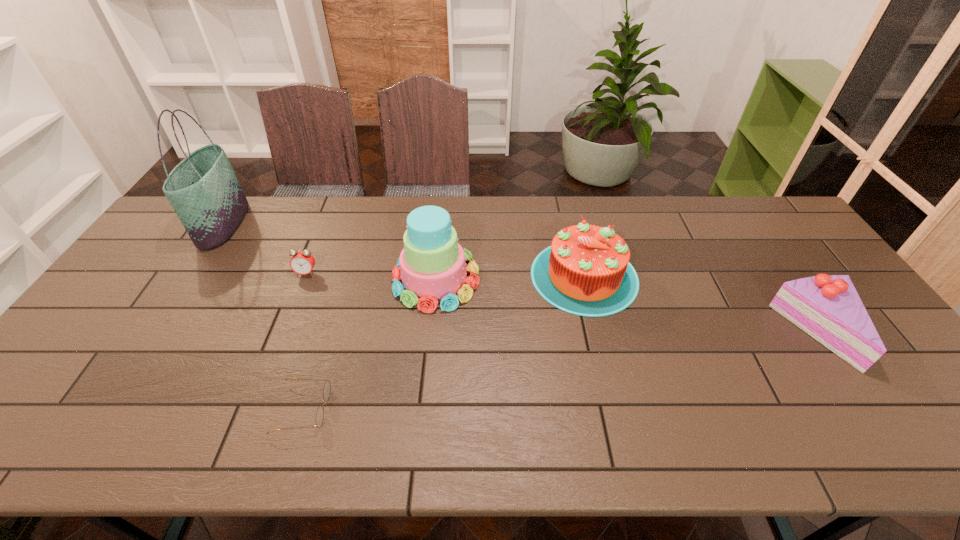
Where is `free space in the image that satisfies the following two spatial constraints: 1. on the front side of the leftmost object; 2. on the left side of the third shortest object`? This screenshot has height=540, width=960. free space in the image that satisfies the following two spatial constraints: 1. on the front side of the leftmost object; 2. on the left side of the third shortest object is located at coordinates (152, 333).

The height and width of the screenshot is (540, 960). I want to click on free spot that satisfies the following two spatial constraints: 1. on the front-facing side of the alarm clock; 2. on the right side of the second cake from right to left, so click(305, 276).

At what (x,y) coordinates should I click in order to perform the action: click on blank area in the image that satisfies the following two spatial constraints: 1. on the front-facing side of the tallest cake; 2. on the left side of the second shortest object. Please return your answer as a coordinate pair (x, y). The width and height of the screenshot is (960, 540). Looking at the image, I should click on (304, 279).

In order to click on vacant position in the image that satisfies the following two spatial constraints: 1. on the front side of the rightmost cake; 2. on the left side of the leftmost cake in this screenshot , I will do `click(430, 333)`.

Where is `free space that satisfies the following two spatial constraints: 1. on the front side of the shortest cake; 2. on the left side of the leftmost object`? This screenshot has width=960, height=540. free space that satisfies the following two spatial constraints: 1. on the front side of the shortest cake; 2. on the left side of the leftmost object is located at coordinates pos(152,333).

The width and height of the screenshot is (960, 540). I want to click on free space that satisfies the following two spatial constraints: 1. on the front-facing side of the fifth object from right to left; 2. on the right side of the leftmost cake, so click(x=304, y=279).